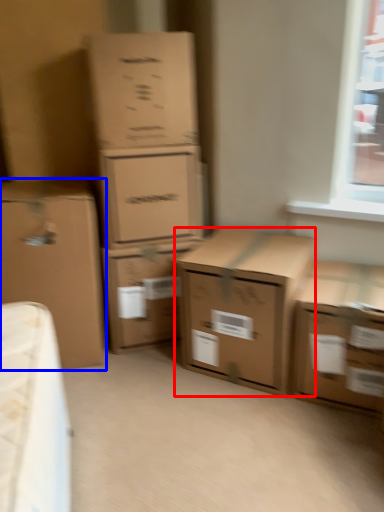
Question: Which object appears farthest to the camera in this image, box (highlighted by a red box) or box (highlighted by a blue box)?

Choices:
 (A) box
 (B) box

Answer: (B)